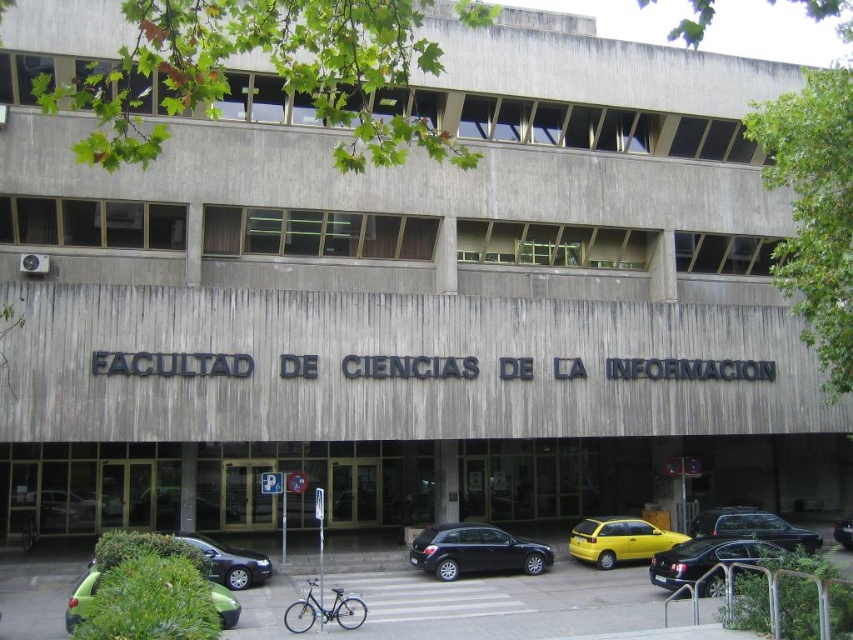
Measure the distance from shiny black sedan at center to blue metallic bicycle at center.

A distance of 22.93 meters exists between shiny black sedan at center and blue metallic bicycle at center.

Who is positioned more to the right, shiny black sedan at center or blue metallic bicycle at center?

shiny black sedan at center is more to the right.

You are a GUI agent. You are given a task and a screenshot of the screen. Output one action in this format:
    pyautogui.click(x=<x>, y=<y>)
    Task: Click on the shiny black sedan at center
    The image size is (853, 640).
    Given the screenshot: What is the action you would take?
    pyautogui.click(x=753, y=528)

Locate an element on the screen. The width and height of the screenshot is (853, 640). shiny black sedan at center is located at coordinates (753, 528).

Is green matte car at lower left bigger than shiny black sedan at lower right?

Indeed, green matte car at lower left has a larger size compared to shiny black sedan at lower right.

Does green matte car at lower left appear on the left side of shiny black sedan at lower right?

Correct, you'll find green matte car at lower left to the left of shiny black sedan at lower right.

The height and width of the screenshot is (640, 853). Find the location of `green matte car at lower left`. green matte car at lower left is located at coordinates pos(146,552).

What do you see at coordinates (178, 508) in the screenshot? This screenshot has height=640, width=853. I see `green matte car at center` at bounding box center [178, 508].

Does green matte car at center appear under blue metallic bicycle at lower center?

Yes.

Who is more distant from viewer, (x=169, y=486) or (x=314, y=596)?

Point (x=169, y=486)

In order to click on green matte car at center in this screenshot , I will do `click(178, 508)`.